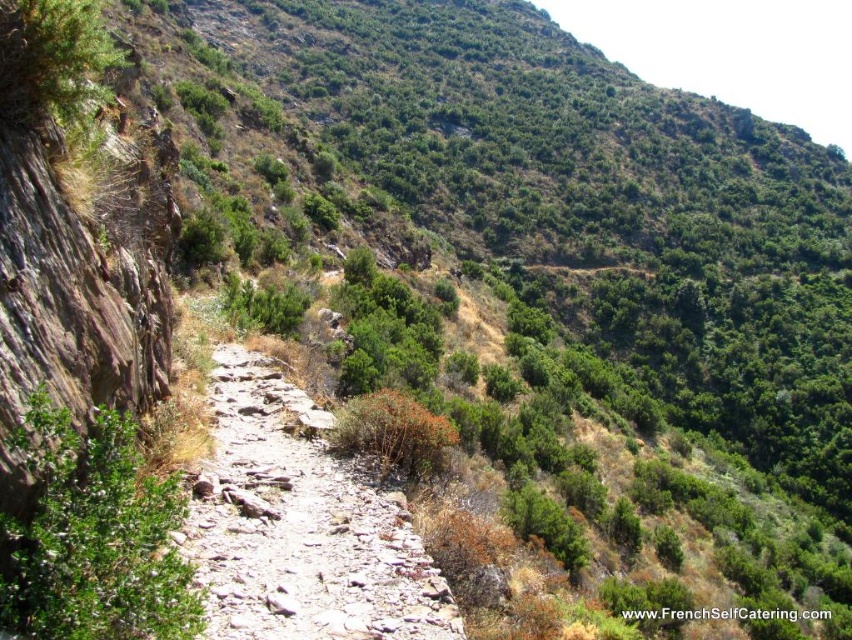
You are a hiker carrying a heavy backpack and need to navigate the terrain shown in the image. Which object, the dusty stone path at center or the green leafy bush at center, would be more suitable for placing your backpack temporarily while you rest?

The dusty stone path at center is larger in size than the green leafy bush at center, so the dusty stone path at center would be more suitable for placing your backpack temporarily because it has a larger surface area to accommodate the backpack safely.

You are a hiker trying to navigate the steep, rocky hillside. You notice two points marked on your map corresponding to coordinates in the image. The first point is at position point (366, 554) and the second is at point (38, 417). Which point is closer to your current position if you are standing at the base of the hill facing upwards?

Point (38, 417) is closer to your current position because it is closer to the bottom of the hill, while point (366, 554) is further up the slope and thus further away from the base.

You are a hiker standing at the base of the steep, rocky hillside. You see a point marked at coordinates (300,525). Is there a dusty stone path at that point?

Yes, the dusty stone path at center is located at point (300,525).